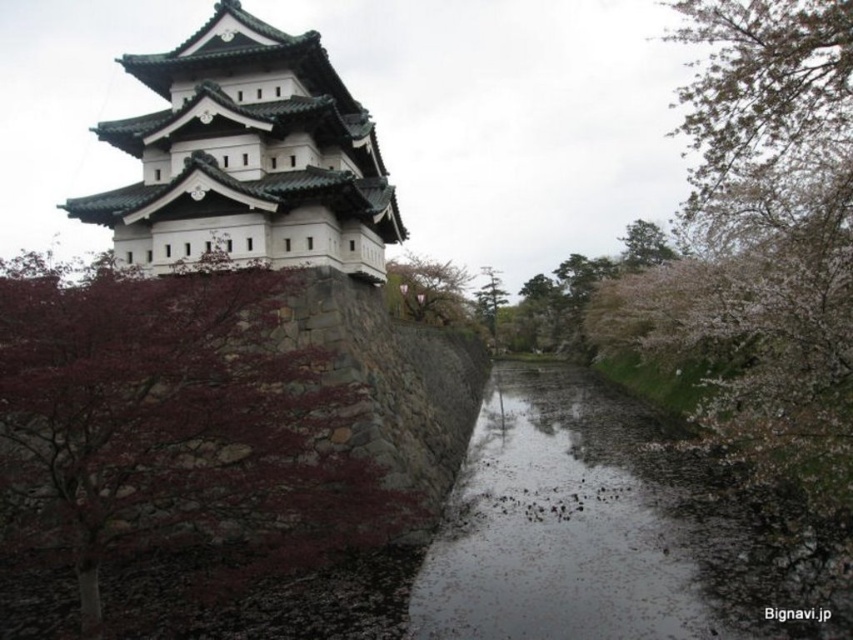
Is white stone tower at upper left smaller than green textured tree at center?

No, white stone tower at upper left is not smaller than green textured tree at center.

Which of these two, white stone tower at upper left or green textured tree at center, stands shorter?

With less height is white stone tower at upper left.

The height and width of the screenshot is (640, 853). Identify the location of white stone tower at upper left. (247, 156).

Locate an element on the screen. white stone tower at upper left is located at coordinates (247, 156).

Which of these two, dark red bark tree at left or white stone tower at upper left, stands shorter?

dark red bark tree at left

Is point (80, 513) positioned in front of point (125, 211)?

That is True.

Locate an element on the screen. The image size is (853, 640). dark red bark tree at left is located at coordinates (173, 429).

Is white blossoming branches at upper right positioned in front of green textured tree at center?

Yes.

What do you see at coordinates (762, 106) in the screenshot?
I see `white blossoming branches at upper right` at bounding box center [762, 106].

Find the location of `white blossoming branches at upper right`. white blossoming branches at upper right is located at coordinates (762, 106).

Identify the location of white blossoming branches at upper right. The image size is (853, 640). (762, 106).